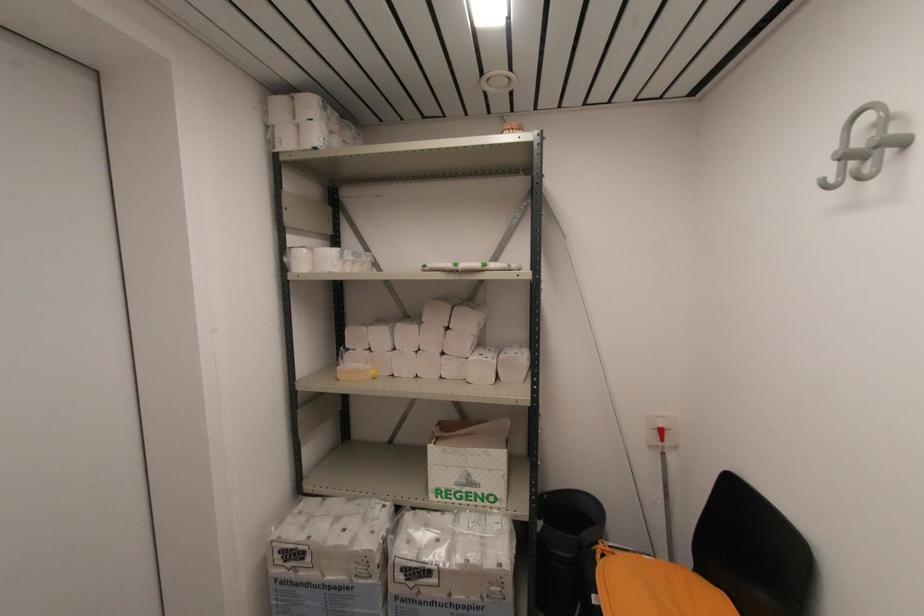
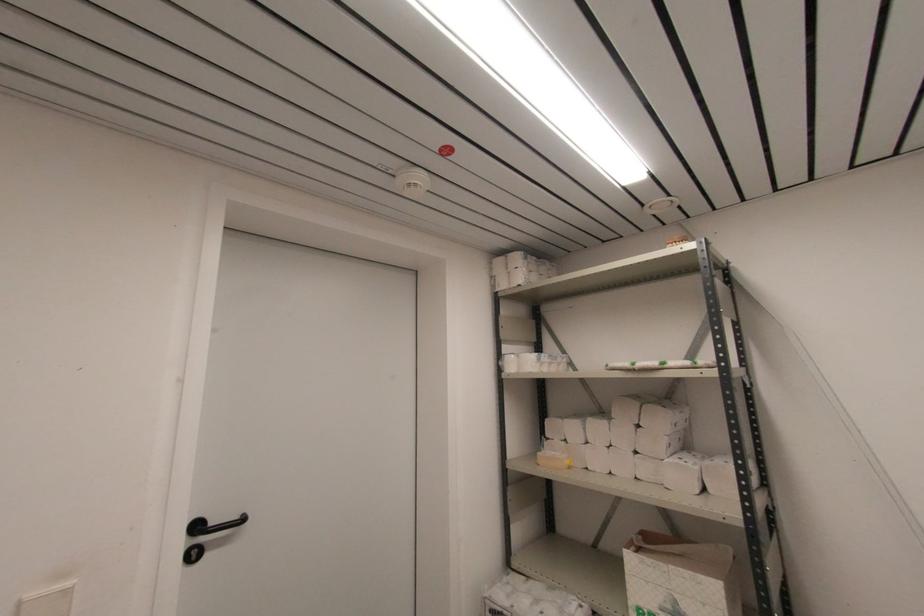
Where in the second image is the point corresponding to point 465,480 from the first image?

(671, 609)